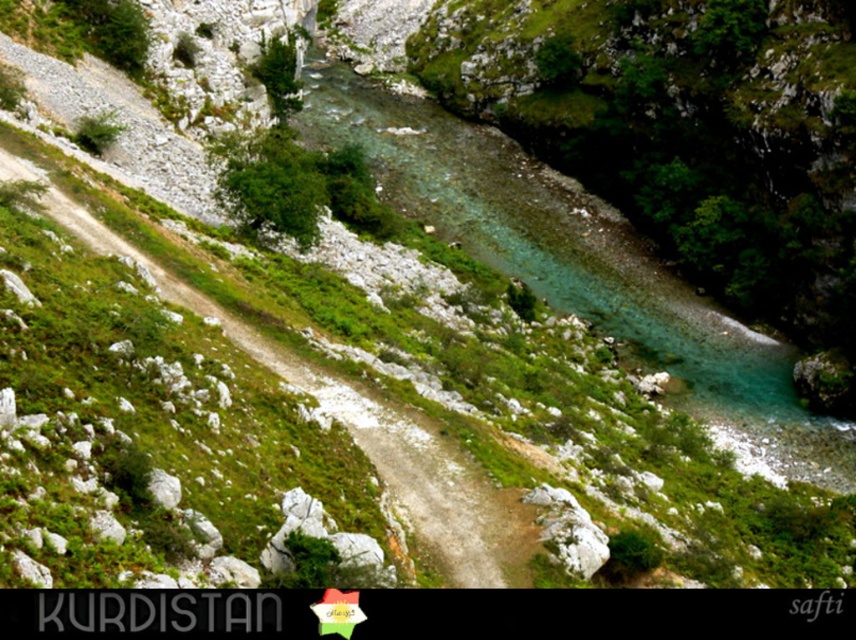
Question: Is the position of clear water at center more distant than that of dirt path at center?

Choices:
 (A) no
 (B) yes

Answer: (B)

Question: Which point is farther to the camera?

Choices:
 (A) (331, 396)
 (B) (421, 144)

Answer: (B)

Question: Which object is farther from the camera taking this photo?

Choices:
 (A) clear water at center
 (B) dirt path at center

Answer: (A)

Question: Where is clear water at center located in relation to dirt path at center in the image?

Choices:
 (A) below
 (B) above

Answer: (B)

Question: Does clear water at center appear on the right side of dirt path at center?

Choices:
 (A) no
 (B) yes

Answer: (B)